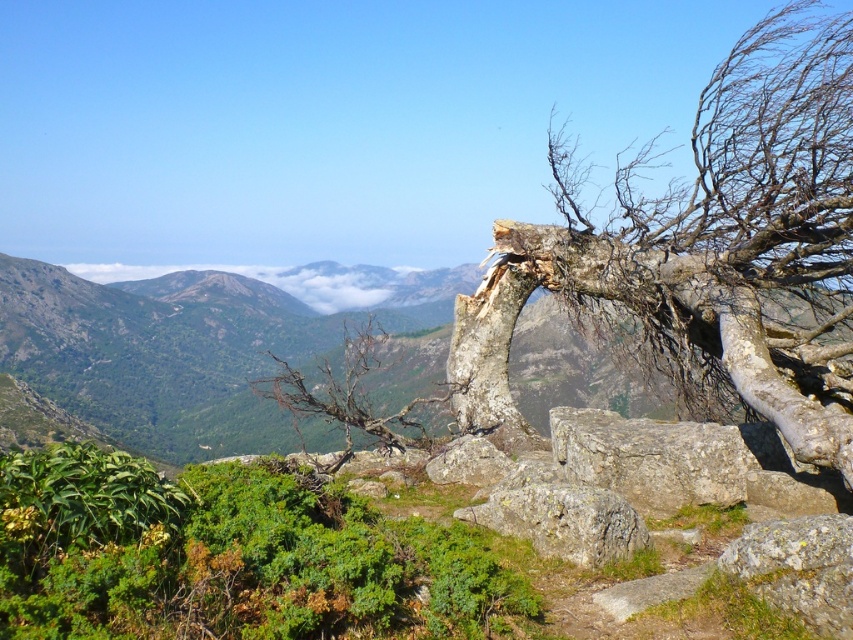
Question: Is gray rough stone at center to the left of bare wood tree at center from the viewer's perspective?

Choices:
 (A) no
 (B) yes

Answer: (A)

Question: Estimate the real-world distances between objects in this image. Which object is closer to the bare wood tree at center?

Choices:
 (A) gray rough tree trunk at right
 (B) white fluffy cloud at center
 (C) gray rough rock at center

Answer: (C)

Question: Which object is the farthest from the gray rough tree trunk at right?

Choices:
 (A) white fluffy cloud at center
 (B) bare wood tree at center
 (C) gray rough rock at center
 (D) gray rough stone at center

Answer: (A)

Question: Is gray rough tree trunk at right closer to camera compared to white fluffy cloud at center?

Choices:
 (A) yes
 (B) no

Answer: (A)

Question: Which is nearer to the bare wood tree at center?

Choices:
 (A) white fluffy cloud at center
 (B) gray rough stone at center
 (C) gray rough tree trunk at right
 (D) gray rough rock at center

Answer: (D)

Question: Is gray rough tree trunk at right to the right of gray rough rock at center from the viewer's perspective?

Choices:
 (A) no
 (B) yes

Answer: (B)